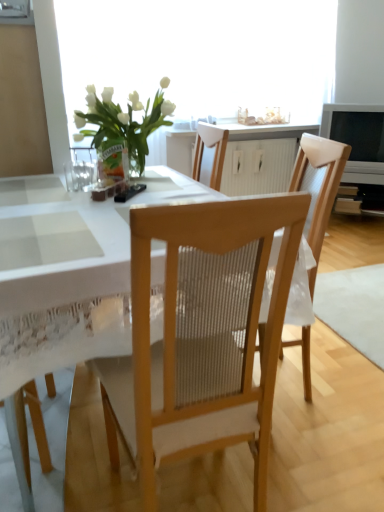
Question: From the image's perspective, would you say white lace tablecloth at center is positioned over white wood cabinet at center?

Choices:
 (A) no
 (B) yes

Answer: (A)

Question: Is white lace tablecloth at center oriented towards white wood cabinet at center?

Choices:
 (A) no
 (B) yes

Answer: (A)

Question: Does white lace tablecloth at center have a lesser height compared to white wood cabinet at center?

Choices:
 (A) no
 (B) yes

Answer: (A)

Question: Is white lace tablecloth at center beside white wood cabinet at center?

Choices:
 (A) yes
 (B) no

Answer: (B)

Question: Can white wood cabinet at center be found inside white lace tablecloth at center?

Choices:
 (A) no
 (B) yes

Answer: (A)

Question: Does white lace tablecloth at center appear on the right side of white wood cabinet at center?

Choices:
 (A) no
 (B) yes

Answer: (A)

Question: Can you confirm if translucent glass window screen at upper center is positioned to the right of white lace tablecloth at center?

Choices:
 (A) no
 (B) yes

Answer: (B)

Question: Could you tell me if translucent glass window screen at upper center is facing white lace tablecloth at center?

Choices:
 (A) no
 (B) yes

Answer: (B)

Question: From the image's perspective, is translucent glass window screen at upper center below white lace tablecloth at center?

Choices:
 (A) no
 (B) yes

Answer: (A)

Question: From a real-world perspective, is translucent glass window screen at upper center below white lace tablecloth at center?

Choices:
 (A) yes
 (B) no

Answer: (B)

Question: Does translucent glass window screen at upper center have a smaller size compared to white lace tablecloth at center?

Choices:
 (A) no
 (B) yes

Answer: (B)

Question: From a real-world perspective, is translucent glass window screen at upper center physically above white lace tablecloth at center?

Choices:
 (A) no
 (B) yes

Answer: (B)

Question: Is translucent glass window screen at upper center not within white wood cabinet at center?

Choices:
 (A) yes
 (B) no

Answer: (A)